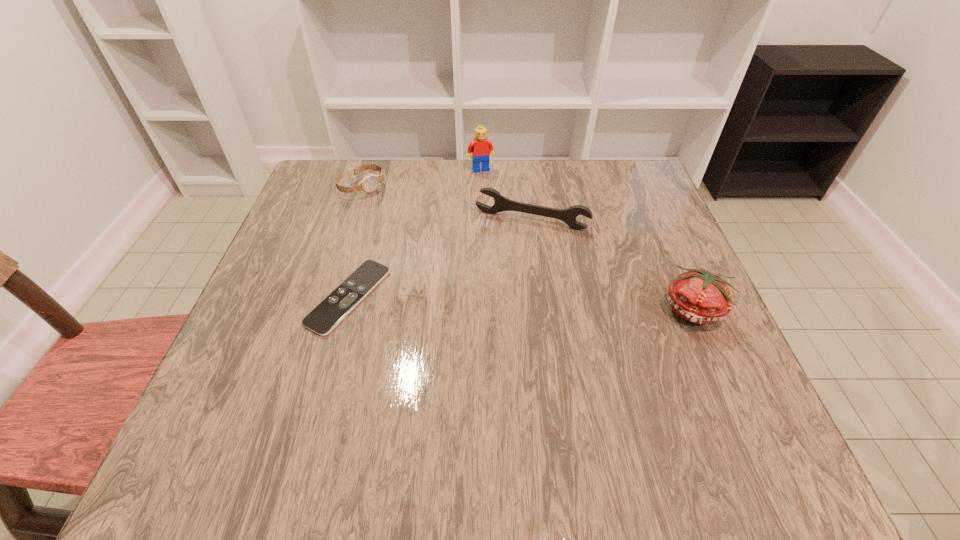
I want to click on vacant region located 0.050m on the front-facing side of the tomato, so click(714, 356).

Locate an element on the screen. This screenshot has height=540, width=960. vacant space located on the open ends of the third farthest object is located at coordinates click(491, 296).

Find the location of a particular element. This screenshot has width=960, height=540. vacant space situated 0.350m on the open ends of the third farthest object is located at coordinates (469, 350).

Locate an element on the screen. The height and width of the screenshot is (540, 960). free region located 0.250m on the open ends of the third farthest object is located at coordinates (485, 310).

The image size is (960, 540). What are the coordinates of `free spot located on the face of the fourth nearest object` in the screenshot? It's located at (452, 266).

Where is `vacant space located on the face of the fourth nearest object`? The width and height of the screenshot is (960, 540). vacant space located on the face of the fourth nearest object is located at coordinates (394, 214).

Where is `blank area located on the face of the fourth nearest object`? The width and height of the screenshot is (960, 540). blank area located on the face of the fourth nearest object is located at coordinates (383, 204).

Where is `vacant area situated 0.350m on the face of the tallest object`? Image resolution: width=960 pixels, height=540 pixels. vacant area situated 0.350m on the face of the tallest object is located at coordinates (512, 259).

You are a GUI agent. You are given a task and a screenshot of the screen. Output one action in this format:
    pyautogui.click(x=<x>, y=<y>)
    Task: Click on the vacant position located 0.050m on the face of the tallest object
    The height and width of the screenshot is (540, 960).
    Given the screenshot: What is the action you would take?
    pyautogui.click(x=487, y=183)

Find the location of a particular element. free space located 0.320m on the face of the tallest object is located at coordinates (509, 249).